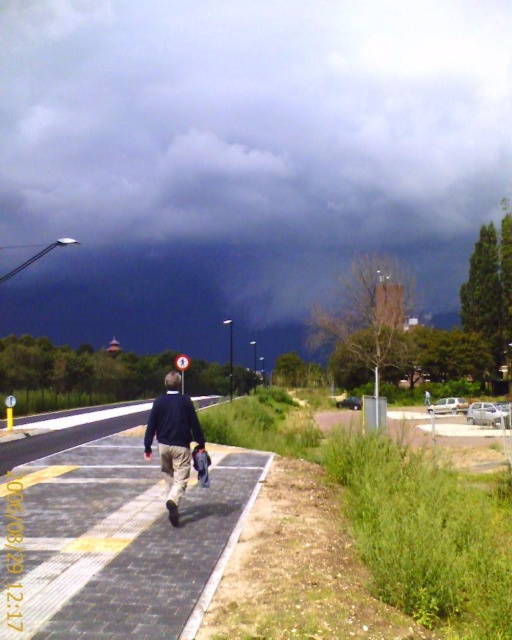
You are standing at the point marked as point (112, 540). What material are you standing on?

You are standing on black asphalt pavement at center.

Based on the photo, you are a pedestrian trying to cross the road. You see the black asphalt pavement at center and the dark blue sweater at center. Which object is closer to you as you approach the road?

The black asphalt pavement at center is closer to you because it is in front of the dark blue sweater at center.